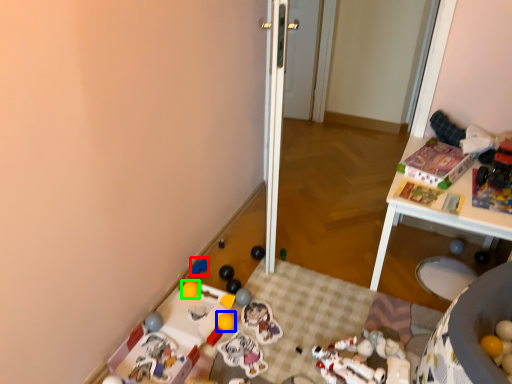
Question: Based on their relative distances, which object is nearer to toy (highlighted by a red box)? Choose from toy (highlighted by a blue box) and toy (highlighted by a green box).

Choices:
 (A) toy
 (B) toy

Answer: (B)